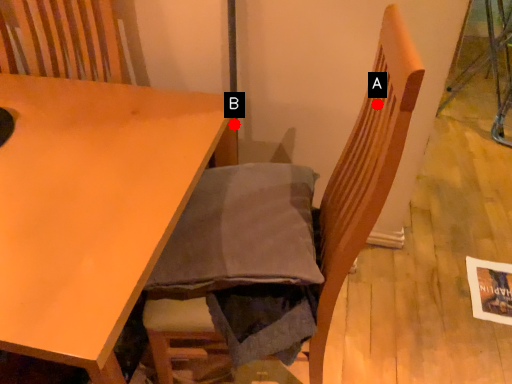
Question: Two points are circled on the image, labeled by A and B beside each circle. Among these points, which one is farthest from the camera?

Choices:
 (A) A is further
 (B) B is further

Answer: (B)